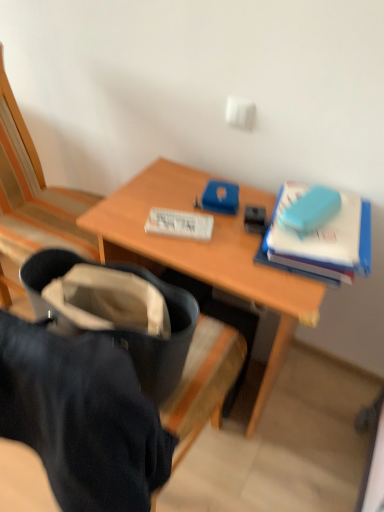
Question: Considering the relative sizes of blue matte book at upper right, the 1th paperback book in the right-to-left sequence, and wooden chair at left in the image provided, is blue matte book at upper right, the 1th paperback book in the right-to-left sequence, smaller than wooden chair at left?

Choices:
 (A) yes
 (B) no

Answer: (A)

Question: From the image's perspective, would you say blue matte book at upper right, arranged as the second paperback book when viewed from the left, is shown under wooden chair at left?

Choices:
 (A) no
 (B) yes

Answer: (B)

Question: Would you say wooden chair at left is part of blue matte book at upper right, the 1th paperback book in the right-to-left sequence,'s contents?

Choices:
 (A) yes
 (B) no

Answer: (B)

Question: Can you confirm if blue matte book at upper right, the 1th paperback book in the right-to-left sequence, is bigger than wooden chair at left?

Choices:
 (A) no
 (B) yes

Answer: (A)

Question: Is blue matte book at upper right, the 1th paperback book in the right-to-left sequence, far away from wooden chair at left?

Choices:
 (A) no
 (B) yes

Answer: (A)

Question: Considering their positions, is blue matte book at upper right, the 1th paperback book in the right-to-left sequence, located in front of or behind white paper at center, which appears as the second paperback book when viewed from the right?

Choices:
 (A) front
 (B) behind

Answer: (A)

Question: Does point (319, 242) appear closer or farther from the camera than point (148, 215)?

Choices:
 (A) farther
 (B) closer

Answer: (B)

Question: Is blue matte book at upper right, the 1th paperback book in the right-to-left sequence, taller or shorter than white paper at center, placed as the first paperback book when sorted from left to right?

Choices:
 (A) short
 (B) tall

Answer: (B)

Question: Based on their sizes in the image, would you say blue matte book at upper right, the 1th paperback book in the right-to-left sequence, is bigger or smaller than white paper at center, which appears as the second paperback book when viewed from the right?

Choices:
 (A) big
 (B) small

Answer: (A)

Question: Looking at their shapes, would you say black fabric bag at center is wider or thinner than wooden desk at center?

Choices:
 (A) wide
 (B) thin

Answer: (B)

Question: In terms of size, does black fabric bag at center appear bigger or smaller than wooden desk at center?

Choices:
 (A) small
 (B) big

Answer: (A)

Question: Is black fabric bag at center situated inside wooden desk at center or outside?

Choices:
 (A) outside
 (B) inside

Answer: (A)

Question: Relative to wooden desk at center, is black fabric bag at center in front or behind?

Choices:
 (A) behind
 (B) front

Answer: (B)

Question: Choose the correct answer: Is black fabric bag at center inside wooden chair at left or outside it?

Choices:
 (A) inside
 (B) outside

Answer: (B)

Question: Visually, is black fabric bag at center positioned to the left or to the right of wooden chair at left?

Choices:
 (A) right
 (B) left

Answer: (A)